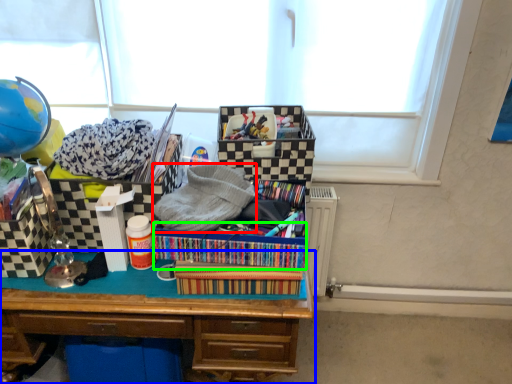
Question: Which object is the closest to the clothing (highlighted by a red box)? Choose among these: desk (highlighted by a blue box) or crate (highlighted by a green box).

Choices:
 (A) desk
 (B) crate

Answer: (B)